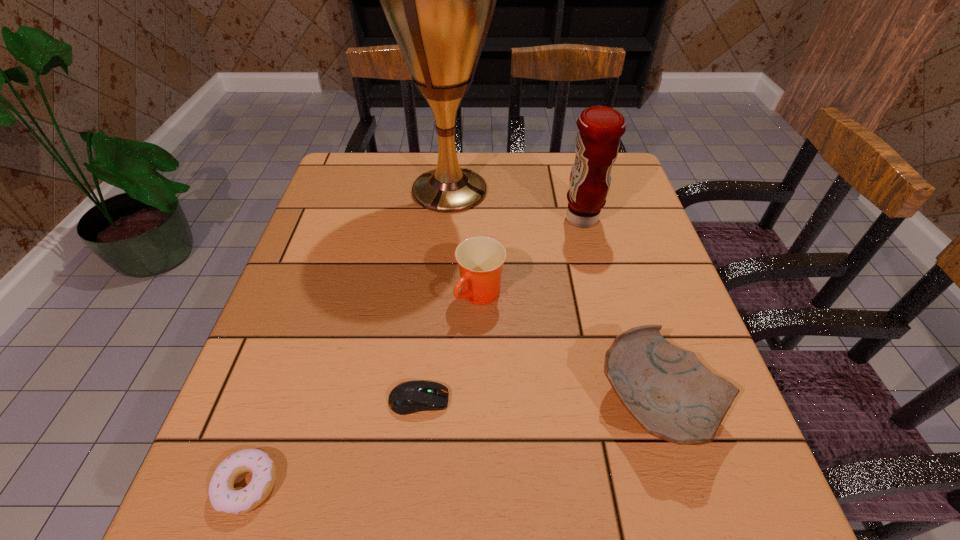
Where is `vacant point at the near edge`? This screenshot has height=540, width=960. vacant point at the near edge is located at coordinates pos(337,490).

In the image, there is a desktop. Where is `vacant space at the left edge`? vacant space at the left edge is located at coordinates (x=347, y=321).

This screenshot has height=540, width=960. In the image, there is a desktop. Find the location of `free space at the right edge`. free space at the right edge is located at coordinates (639, 219).

At what (x,y) coordinates should I click in order to perform the action: click on free space at the far left corner of the desktop. Please return your answer as a coordinate pair (x, y). This screenshot has height=540, width=960. Looking at the image, I should click on (377, 194).

Find the location of `vacant point at the near left corner`. vacant point at the near left corner is located at coordinates (192, 497).

The image size is (960, 540). I want to click on free space at the far right corner of the desktop, so click(623, 167).

Locate an element on the screen. free space between the computer equipment and the leftmost object is located at coordinates (333, 442).

Find the location of `blank region between the doughnut and the trophy cup`. blank region between the doughnut and the trophy cup is located at coordinates (348, 338).

Where is `free space between the leftmost object and the fourth shortest object`? The width and height of the screenshot is (960, 540). free space between the leftmost object and the fourth shortest object is located at coordinates (364, 390).

You are a GUI agent. You are given a task and a screenshot of the screen. Output one action in this format:
    pyautogui.click(x=<x>, y=<y>)
    Task: Click on the free space between the computer equipment and the pottery
    Image resolution: width=960 pixels, height=540 pixels.
    Given the screenshot: What is the action you would take?
    pyautogui.click(x=539, y=402)